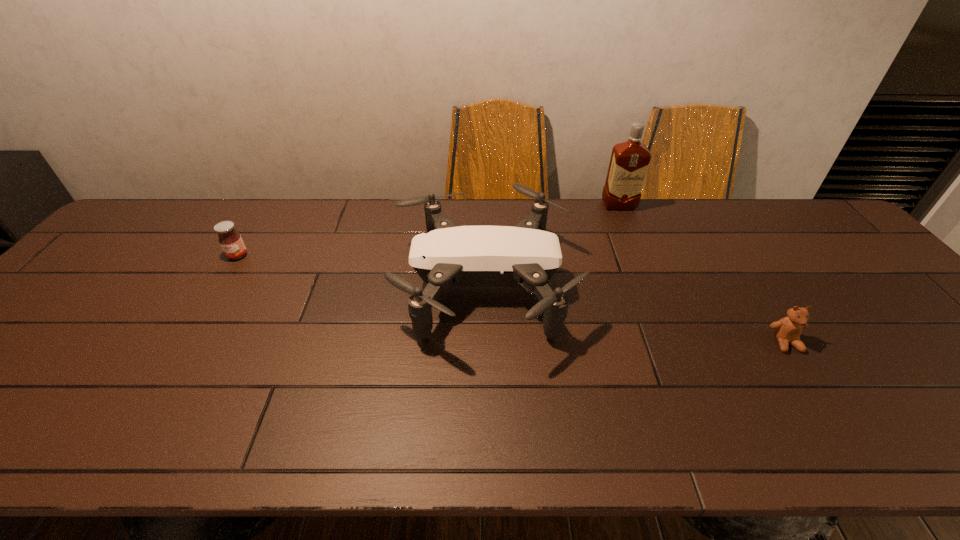
Locate an element on the screen. liquor is located at coordinates (x=629, y=162).

Find the location of `the second object from right to left`. the second object from right to left is located at coordinates (629, 162).

Image resolution: width=960 pixels, height=540 pixels. Find the location of `drone`. drone is located at coordinates (448, 255).

Find the location of `the second object from left to right`. the second object from left to right is located at coordinates (448, 255).

Locate an element on the screen. The width and height of the screenshot is (960, 540). the rightmost object is located at coordinates (787, 330).

The width and height of the screenshot is (960, 540). Find the location of `the leftmost object`. the leftmost object is located at coordinates (230, 240).

Locate an element on the screen. The height and width of the screenshot is (540, 960). vacant area situated on the front label of the farthest object is located at coordinates (633, 240).

The height and width of the screenshot is (540, 960). Find the location of `free space located 0.280m on the camera side of the drone`. free space located 0.280m on the camera side of the drone is located at coordinates (289, 284).

I want to click on free space located 0.230m on the camera side of the drone, so click(308, 284).

Image resolution: width=960 pixels, height=540 pixels. I want to click on free location located 0.370m on the camera side of the drone, so click(256, 284).